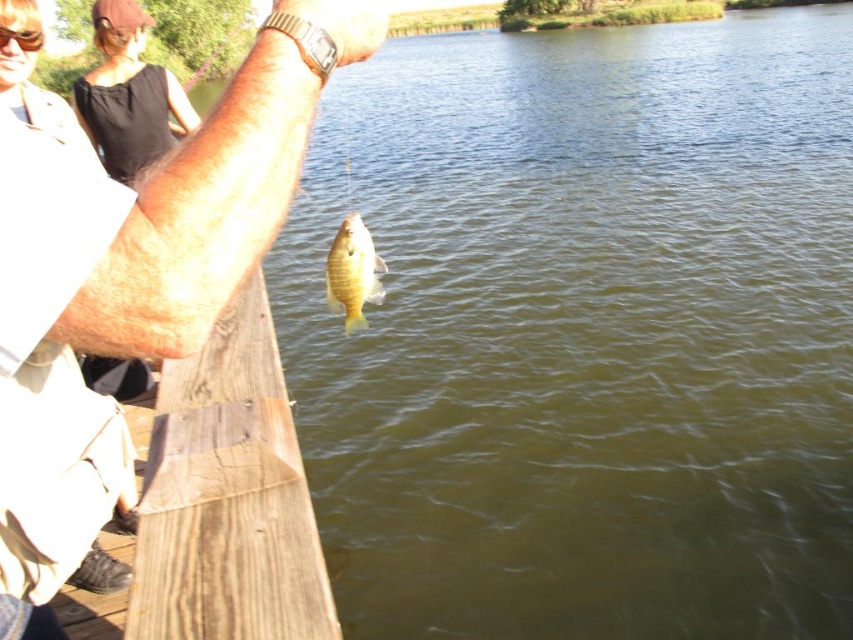
Question: Does brown wood dock at lower left appear over yellow shiny fish at center?

Choices:
 (A) no
 (B) yes

Answer: (A)

Question: Can you confirm if matte wood arm at upper left is thinner than transparent plastic goggles at upper left?

Choices:
 (A) yes
 (B) no

Answer: (B)

Question: Which object appears farthest from the camera in this image?

Choices:
 (A) transparent plastic goggles at upper left
 (B) matte wood arm at upper left
 (C) yellow shiny fish at center
 (D) brown wood dock at lower left

Answer: (A)

Question: Which point is closer to the camera?

Choices:
 (A) yellow shiny fish at center
 (B) matte wood arm at upper left

Answer: (B)

Question: Which object is closer to the camera taking this photo?

Choices:
 (A) transparent plastic goggles at upper left
 (B) yellow shiny fish at center
 (C) brown wood dock at lower left

Answer: (C)

Question: From the image, what is the correct spatial relationship of matte wood arm at upper left in relation to brown wood dock at lower left?

Choices:
 (A) right
 (B) left

Answer: (A)